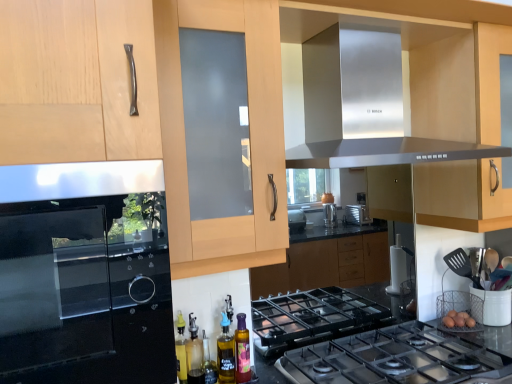
Question: From the image's perspective, is polished stainless steel gas stove at center below stainless steel exhaust hood at upper center?

Choices:
 (A) no
 (B) yes

Answer: (B)

Question: Would you say stainless steel exhaust hood at upper center is part of polished stainless steel gas stove at center's contents?

Choices:
 (A) yes
 (B) no

Answer: (B)

Question: Is polished stainless steel gas stove at center positioned behind stainless steel exhaust hood at upper center?

Choices:
 (A) yes
 (B) no

Answer: (A)

Question: Does polished stainless steel gas stove at center have a lesser height compared to stainless steel exhaust hood at upper center?

Choices:
 (A) yes
 (B) no

Answer: (A)

Question: Does polished stainless steel gas stove at center touch stainless steel exhaust hood at upper center?

Choices:
 (A) no
 (B) yes

Answer: (A)

Question: From a real-world perspective, is satin black oven at left physically located above or below matte wood cabinet at center?

Choices:
 (A) below
 (B) above

Answer: (A)

Question: Do you think satin black oven at left is within matte wood cabinet at center, or outside of it?

Choices:
 (A) inside
 (B) outside

Answer: (B)

Question: Would you say satin black oven at left is to the left or to the right of matte wood cabinet at center in the picture?

Choices:
 (A) left
 (B) right

Answer: (A)

Question: Looking at their shapes, would you say satin black oven at left is wider or thinner than matte wood cabinet at center?

Choices:
 (A) wide
 (B) thin

Answer: (A)

Question: From a real-world perspective, is matte wood cabinet at center physically located above or below stainless steel exhaust hood at upper center?

Choices:
 (A) above
 (B) below

Answer: (B)

Question: Is matte wood cabinet at center spatially inside stainless steel exhaust hood at upper center, or outside of it?

Choices:
 (A) outside
 (B) inside

Answer: (A)

Question: In the image, is matte wood cabinet at center positioned in front of or behind stainless steel exhaust hood at upper center?

Choices:
 (A) behind
 (B) front

Answer: (B)

Question: In terms of height, does matte wood cabinet at center look taller or shorter compared to stainless steel exhaust hood at upper center?

Choices:
 (A) tall
 (B) short

Answer: (A)

Question: Visually, is matte wood cabinet at center positioned to the left or to the right of satin black oven at left?

Choices:
 (A) left
 (B) right

Answer: (B)

Question: In terms of size, does matte wood cabinet at center appear bigger or smaller than satin black oven at left?

Choices:
 (A) big
 (B) small

Answer: (A)